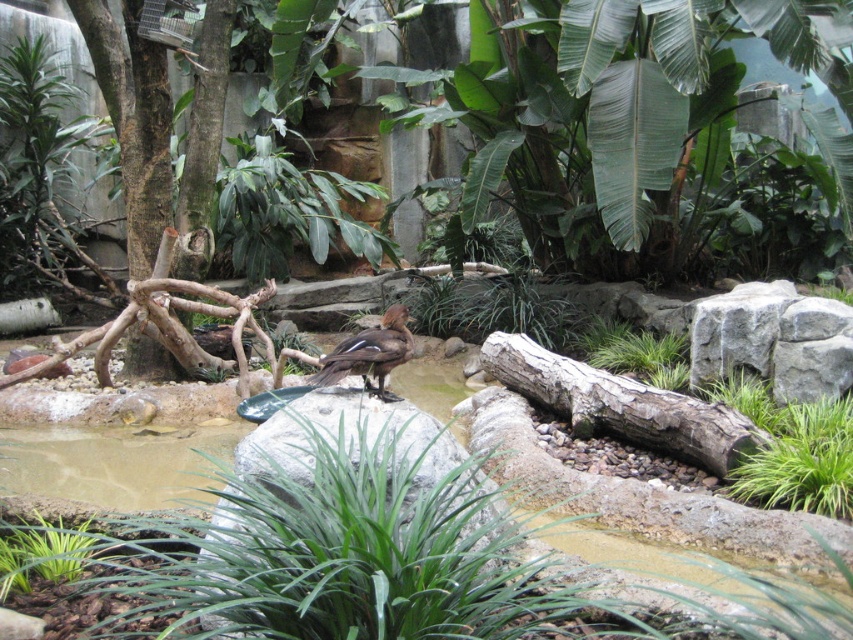
Question: Where is weathered wood log at center-right located in relation to green leafy plant at lower left in the image?

Choices:
 (A) right
 (B) left

Answer: (A)

Question: Which of the following is the closest to the observer?

Choices:
 (A) brown feathered bird at center
 (B) weathered wood log at center-right
 (C) green leafy plant at lower left

Answer: (C)

Question: Which object appears farthest from the camera in this image?

Choices:
 (A) brown feathered bird at center
 (B) weathered wood log at center-right
 (C) green leafy plant at lower left

Answer: (B)

Question: Is weathered wood log at center-right below green leafy plant at lower left?

Choices:
 (A) yes
 (B) no

Answer: (B)

Question: Does weathered wood log at center-right appear over green leafy plant at lower left?

Choices:
 (A) yes
 (B) no

Answer: (A)

Question: Among these objects, which one is farthest from the camera?

Choices:
 (A) brown feathered bird at center
 (B) green leafy plant at lower left
 (C) weathered wood log at center-right

Answer: (C)